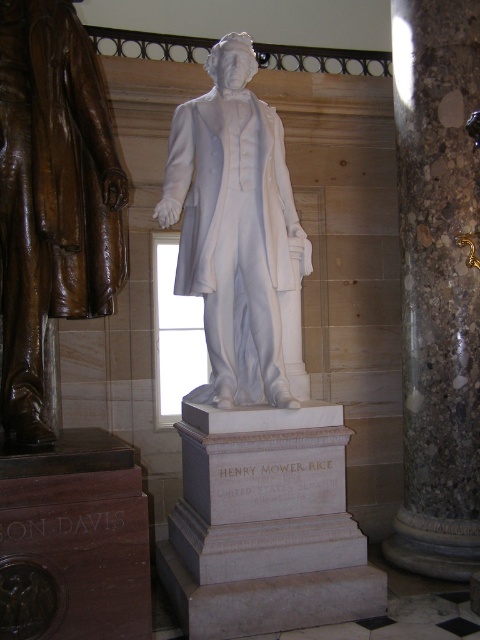
How distant is bronze coat at left from white marble statue at center?

bronze coat at left and white marble statue at center are 88.14 centimeters apart.

In order to click on bronze coat at left in this screenshot , I will do `click(51, 196)`.

Between point (3, 410) and point (228, 349), which one is positioned in front?

Point (3, 410)

Where is `bronze coat at left`? The height and width of the screenshot is (640, 480). bronze coat at left is located at coordinates (51, 196).

Is marble column at right smaller than white marble statue at center?

No, marble column at right is not smaller than white marble statue at center.

Is marble column at right to the right of white marble statue at center from the viewer's perspective?

Indeed, marble column at right is positioned on the right side of white marble statue at center.

Where is `marble column at right`? marble column at right is located at coordinates pos(437,285).

Find the location of a particular element. The height and width of the screenshot is (640, 480). marble column at right is located at coordinates (437, 285).

Who is shorter, marble column at right or bronze coat at left?

Standing shorter between the two is bronze coat at left.

Based on the photo, is marble column at right positioned before bronze coat at left?

No, marble column at right is further to the viewer.

The height and width of the screenshot is (640, 480). Identify the location of marble column at right. (437, 285).